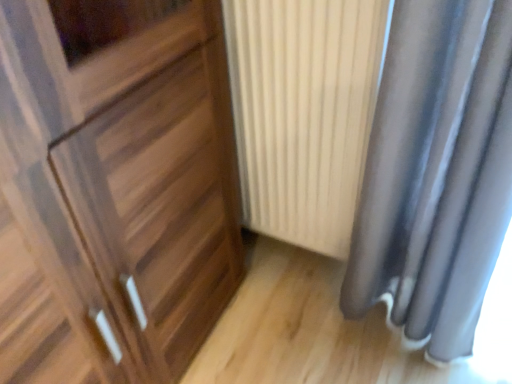
The width and height of the screenshot is (512, 384). Describe the element at coordinates (303, 112) in the screenshot. I see `beige fabric shower curtain at center` at that location.

Locate an element on the screen. beige fabric shower curtain at center is located at coordinates (303, 112).

Measure the distance between beige fabric shower curtain at center and camera.

beige fabric shower curtain at center and camera are 32.93 inches apart.

Locate an element on the screen. Image resolution: width=512 pixels, height=384 pixels. beige fabric shower curtain at center is located at coordinates [303, 112].